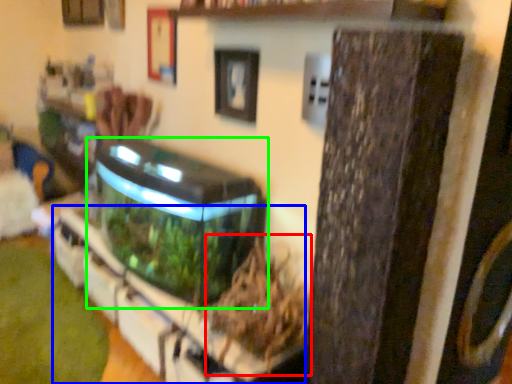
Question: Which object is the farthest from plant (highlighted by a red box)? Choose among these: shelf (highlighted by a blue box) or water tank (highlighted by a green box).

Choices:
 (A) shelf
 (B) water tank

Answer: (B)